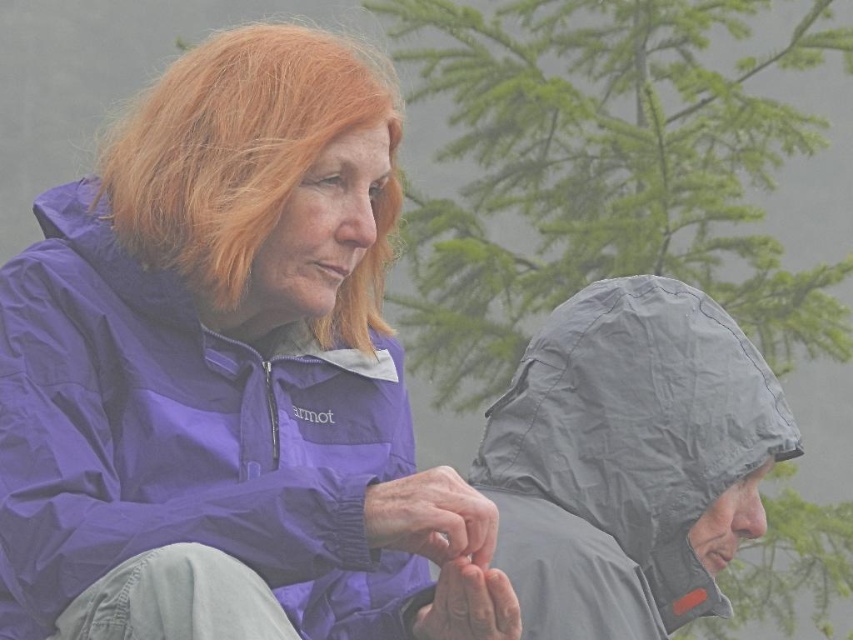
You are trying to decide which of the two items, the purple waterproof jacket at upper left or the gray waterproof hood at right, would be better to take with you on a hiking trip where you expect rain. Based on their sizes, which one is taller and thus might offer better rain protection?

The purple waterproof jacket at upper left is much taller than the gray waterproof hood at right, so it might offer better rain protection due to its greater height.

You are a photographer trying to capture a candid shot of both the gray waterproof hood at right and the blonde hair at upper left. Which object should you focus on first to ensure both are in sharp focus?

You should focus on the gray waterproof hood at right first because it is closer to you than the blonde hair at upper left, ensuring both will be in focus when using depth of field techniques.

You are standing in front of the two people in the image. Which of the two points, point [572,572] or point [231,308], is closer to you?

Point [572,572] is closer to you because it is further to the viewer than point [231,308].